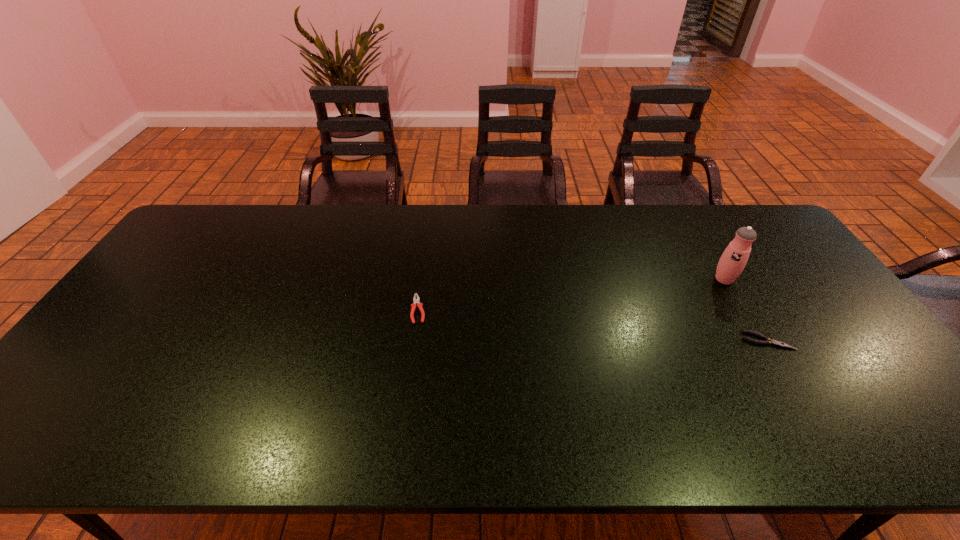
Identify the location of free space at the near edge of the desktop. (792, 437).

The image size is (960, 540). I want to click on blank space at the left edge of the desktop, so [206, 269].

This screenshot has height=540, width=960. In order to click on empty location between the nearer pliers and the leftmost object in this screenshot , I will do `click(593, 325)`.

The image size is (960, 540). Find the location of `empty space between the nearest object and the thermos bottle`. empty space between the nearest object and the thermos bottle is located at coordinates (x=746, y=310).

The width and height of the screenshot is (960, 540). In order to click on vacant area that lies between the farthest object and the nearer pliers in this screenshot , I will do `click(746, 310)`.

Locate an element on the screen. This screenshot has height=540, width=960. unoccupied position between the thermos bottle and the nearest object is located at coordinates (746, 310).

You are a GUI agent. You are given a task and a screenshot of the screen. Output one action in this format:
    pyautogui.click(x=<x>, y=<y>)
    Task: Click on the blank region between the nearer pliers and the left pliers
    
    Given the screenshot: What is the action you would take?
    pyautogui.click(x=593, y=325)

The image size is (960, 540). I want to click on free area in between the farthest object and the second nearest object, so click(571, 294).

Find the location of a particular element. free space between the farthest object and the left pliers is located at coordinates (571, 294).

Identify the location of vacant region between the farther pliers and the nearer pliers. This screenshot has width=960, height=540. (593, 325).